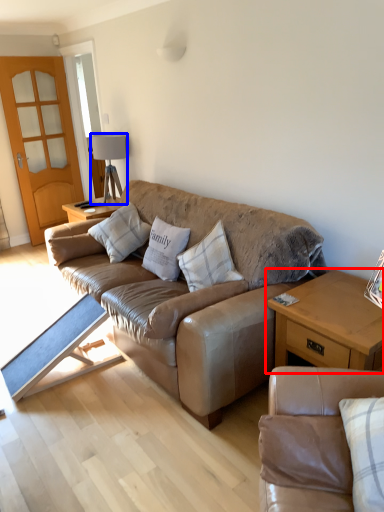
Question: Among these objects, which one is nearest to the camera, table (highlighted by a red box) or lamp (highlighted by a blue box)?

Choices:
 (A) table
 (B) lamp

Answer: (A)